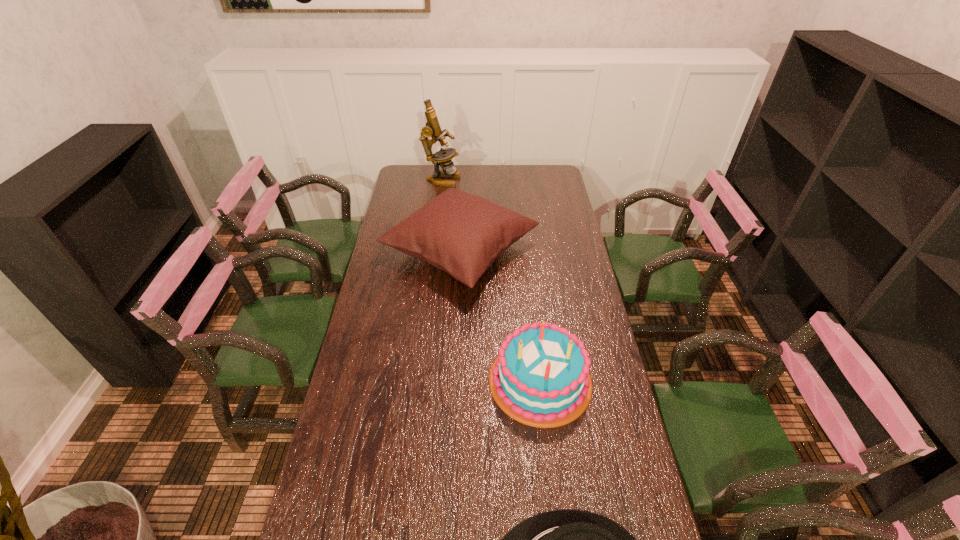
Locate an element on the screen. the farthest object is located at coordinates (443, 157).

In order to click on the tallest object in this screenshot , I will do `click(443, 157)`.

At what (x,y) coordinates should I click in order to perform the action: click on cushion. Please return your answer as a coordinate pair (x, y). Looking at the image, I should click on (462, 234).

In order to click on the second nearest object in this screenshot , I will do `click(542, 377)`.

Where is `vacant space located 0.250m on the right of the farthest object`? Image resolution: width=960 pixels, height=540 pixels. vacant space located 0.250m on the right of the farthest object is located at coordinates (508, 179).

Identify the location of vacant space located 0.100m on the back of the second farthest object. (464, 195).

You are a GUI agent. You are given a task and a screenshot of the screen. Output one action in this format:
    pyautogui.click(x=<x>, y=<y>)
    Task: Click on the blank space located on the front of the birthday cake
    The image size is (960, 540).
    Given the screenshot: What is the action you would take?
    pyautogui.click(x=559, y=539)

Find the location of a particular element. The image size is (960, 540). object located in the far edge section of the desktop is located at coordinates (443, 157).

Identify the location of microscope that is at the left edge. The width and height of the screenshot is (960, 540). pos(443,157).

Locate an element on the screen. cushion that is at the left edge is located at coordinates (462, 234).